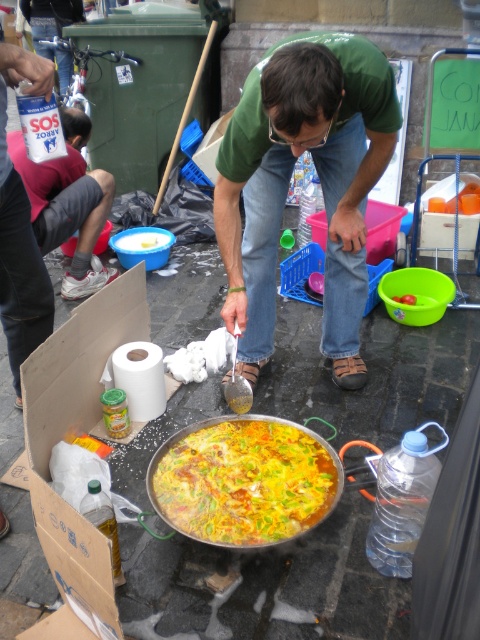
You are a customer at the street food event and want to take a photo of the vibrant yellow and green vegetables at center. Where should you position yourself to capture them in the frame?

The vibrant yellow and green vegetables at center are located at point (x=243, y=481), so you should position yourself slightly to the right and center to ensure they are in the frame.

You are a food critic standing at the edge of the cooking area. You notice the vibrant yellow and green vegetables at center in the pan. Can you determine their exact position relative to the pan?

The vibrant yellow and green vegetables at center are located at point (x=243, y=481) in the pan, which means they are positioned slightly to the right and center of the pan.